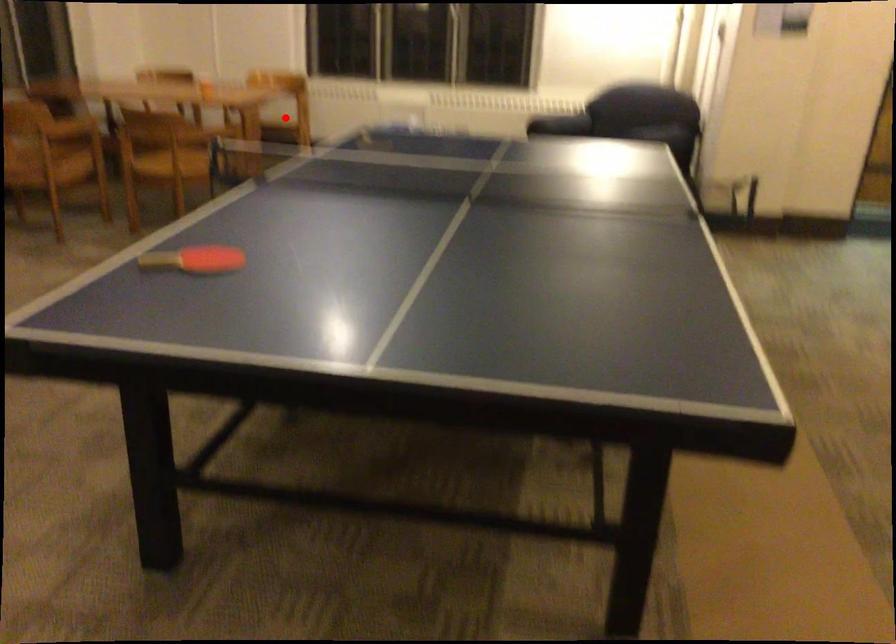
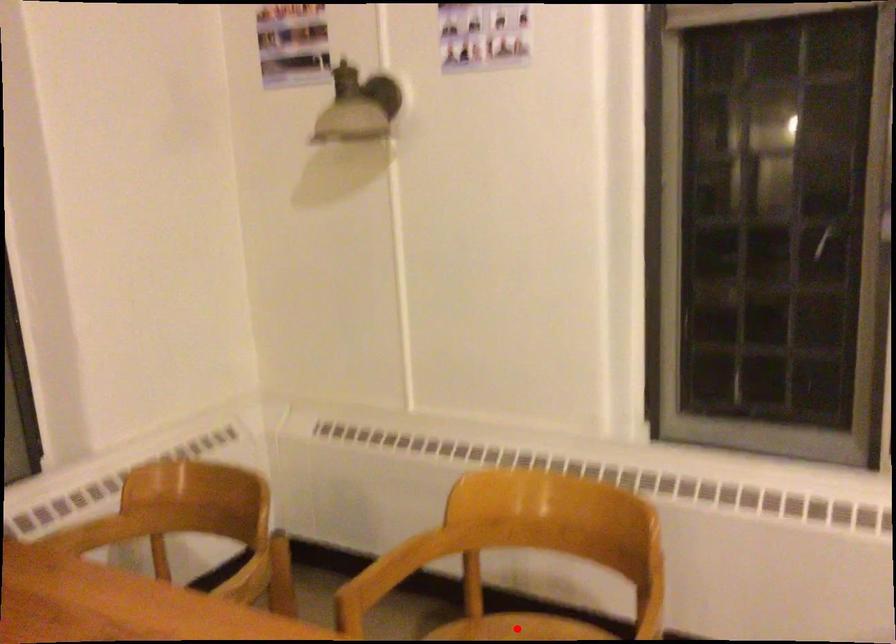
I am providing you with two images of the same scene from different viewpoints. A red point is marked on the first image and another point is marked on the second image. Is the marked point in image1 the same physical position as the marked point in image2?

Yes